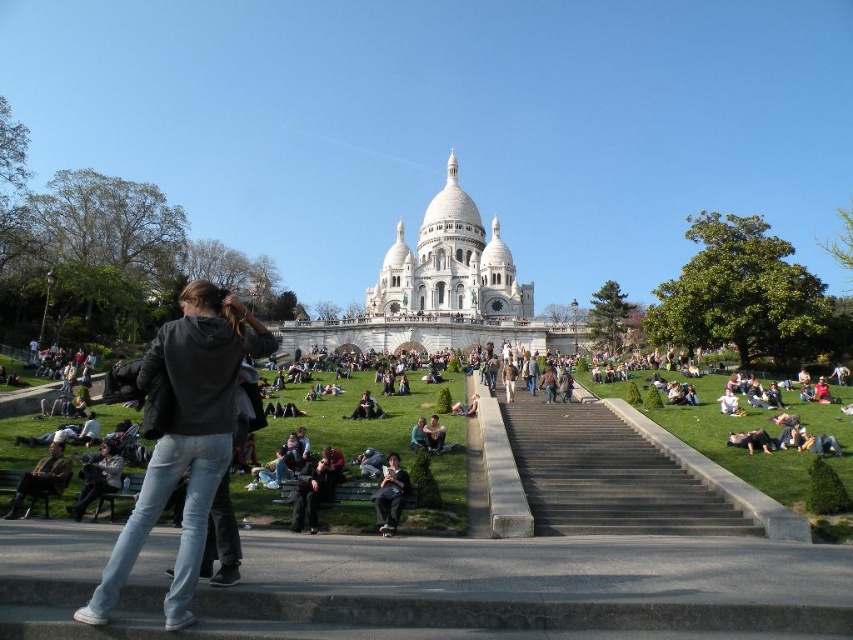
Between green grass at center and brown leather jacket at lower left, which one has more height?

green grass at center is taller.

Who is more distant from viewer, (x=793, y=397) or (x=22, y=493)?

The point (x=793, y=397) is behind.

Who is more distant from viewer, (718, 449) or (44, 472)?

The point (718, 449) is more distant.

The width and height of the screenshot is (853, 640). I want to click on green grass at center, so click(735, 449).

Who is higher up, black concrete stairs at center or jeans at lower left?

jeans at lower left is higher up.

Who is more distant from viewer, (538, 401) or (91, 499)?

Point (538, 401)

At what (x,y) coordinates should I click in order to perform the action: click on black concrete stairs at center. Please return your answer as a coordinate pair (x, y). Looking at the image, I should click on (607, 476).

Who is more forward, (625, 518) or (337, 428)?

Point (625, 518) is more forward.

Who is more distant from viewer, [619,477] or [402,426]?

The point [402,426] is more distant.

Is point (612, 522) positioned before point (840, 435)?

Yes, point (612, 522) is closer to viewer.

What are the coordinates of `black concrete stairs at center` in the screenshot? It's located at (607, 476).